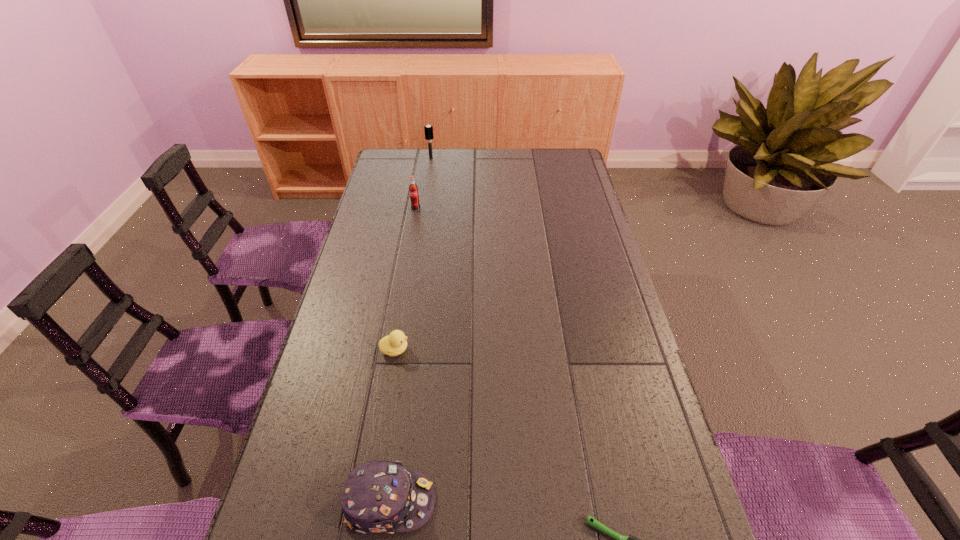
In order to click on unoccupied position between the soda bottle and the farthest object in this screenshot , I will do `click(423, 184)`.

Where is `vacant area that lies between the fourth nearest object and the second shortest object`? The height and width of the screenshot is (540, 960). vacant area that lies between the fourth nearest object and the second shortest object is located at coordinates (405, 279).

Identify which object is located as the third nearest to the duckling. Please provide its 2D coordinates. Your answer should be formatted as a tuple, i.e. [(x, y)], where the tuple contains the x and y coordinates of a point satisfying the conditions above.

[(413, 189)]

Where is `the closest object to the second farthest object`? The image size is (960, 540). the closest object to the second farthest object is located at coordinates (428, 129).